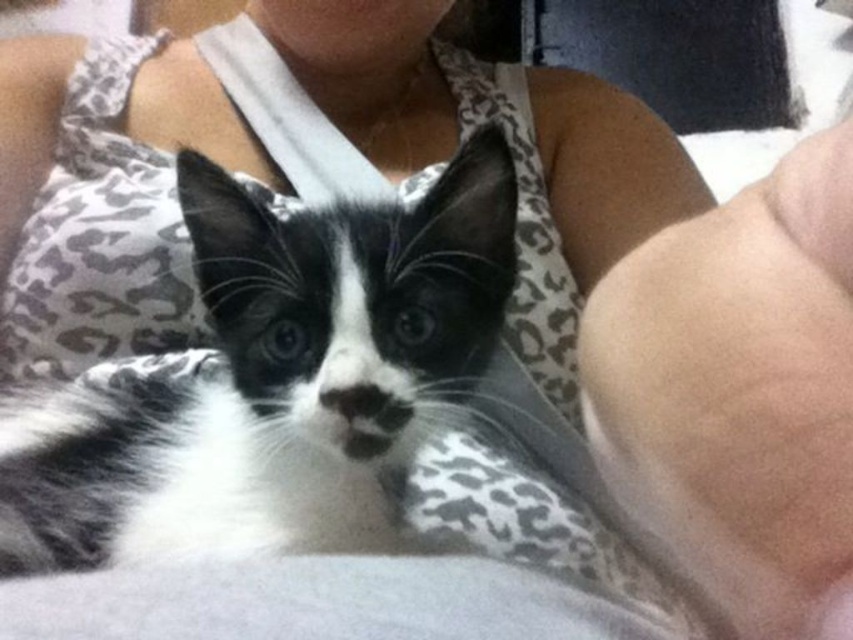
Question: Which of the following is the farthest from the observer?

Choices:
 (A) (671, 253)
 (B) (381, 492)

Answer: (B)

Question: In this image, where is black and white fur cat at center located relative to skinny white skin at lower right?

Choices:
 (A) left
 (B) right

Answer: (A)

Question: Can you confirm if black and white fur cat at center is thinner than skinny white skin at lower right?

Choices:
 (A) no
 (B) yes

Answer: (A)

Question: Is black and white fur cat at center closer to camera compared to skinny white skin at lower right?

Choices:
 (A) yes
 (B) no

Answer: (B)

Question: Which point is farther to the camera?

Choices:
 (A) (244, 470)
 (B) (706, 556)

Answer: (A)

Question: Among these points, which one is nearest to the camera?

Choices:
 (A) (358, 344)
 (B) (752, 365)

Answer: (B)